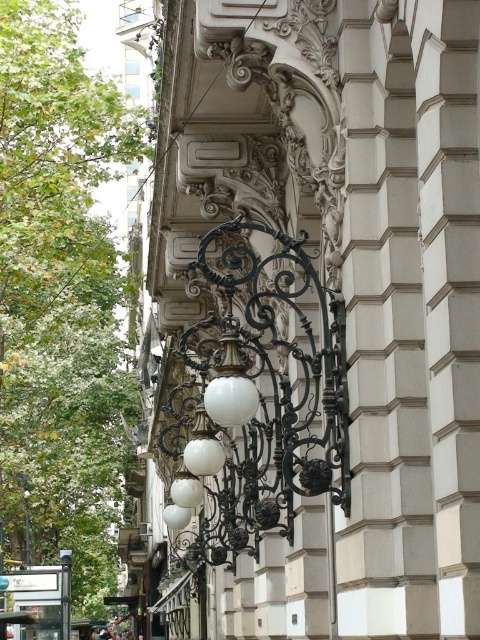
Question: Which of these objects is positioned farthest from the white matte lamp at center?

Choices:
 (A) white matte lamp post at lower left
 (B) white matte lamp post at center

Answer: (B)

Question: Is white matte lamp at center to the right of white matte lamp post at center from the viewer's perspective?

Choices:
 (A) no
 (B) yes

Answer: (B)

Question: Which object is closer to the camera taking this photo?

Choices:
 (A) white matte lamp at center
 (B) white matte lamp post at lower left
 (C) white matte lamp post at center

Answer: (A)

Question: Can you confirm if white matte lamp at center is positioned above white matte lamp post at lower left?

Choices:
 (A) no
 (B) yes

Answer: (B)

Question: Which point appears farthest from the camera in this image?

Choices:
 (A) (25, 513)
 (B) (225, 296)

Answer: (A)

Question: Can you confirm if white matte lamp at center is wider than white matte lamp post at center?

Choices:
 (A) yes
 (B) no

Answer: (A)